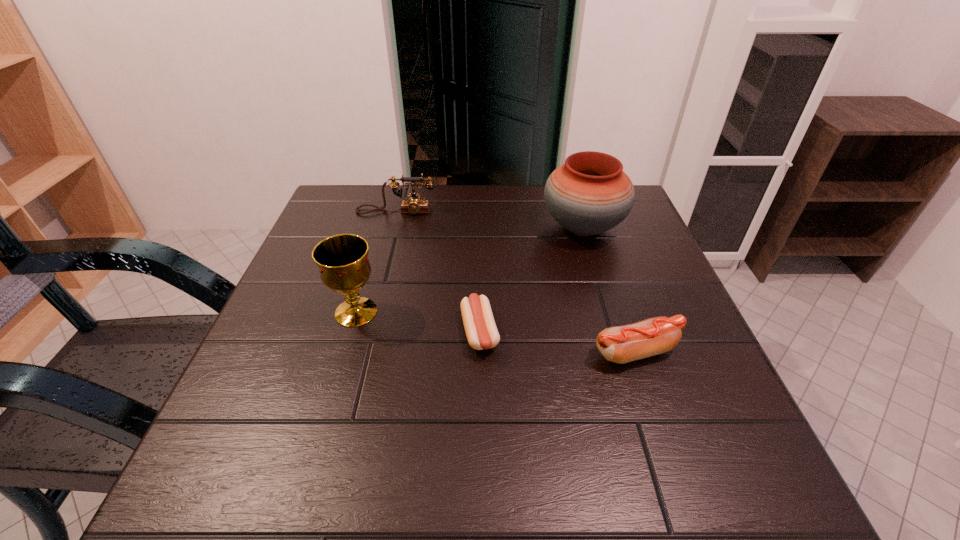
The image size is (960, 540). I want to click on free space between the taller sausage and the telephone, so click(x=516, y=282).

Where is `vacant region between the shortest object and the second shortest object`? This screenshot has height=540, width=960. vacant region between the shortest object and the second shortest object is located at coordinates (558, 342).

In order to click on free space that is in between the taller sausage and the shortest object in this screenshot , I will do `click(558, 342)`.

Locate an element on the screen. This screenshot has height=540, width=960. blank region between the chalice and the third tallest object is located at coordinates (376, 262).

You are a GUI agent. You are given a task and a screenshot of the screen. Output one action in this format:
    pyautogui.click(x=<x>, y=<y>)
    Task: Click on the unoccupied position between the pottery and the chalice
    The width and height of the screenshot is (960, 540).
    Given the screenshot: What is the action you would take?
    pyautogui.click(x=469, y=269)

Where is `the fourth closest object to the pottery`? This screenshot has height=540, width=960. the fourth closest object to the pottery is located at coordinates (343, 261).

Point out which object is positioned as the second nearest to the chalice. Please provide its 2D coordinates. Your answer should be formatted as a tuple, i.e. [(x, y)], where the tuple contains the x and y coordinates of a point satisfying the conditions above.

[(414, 205)]

At what (x,y) coordinates should I click in order to perform the action: click on vacant area in the image that satisfies the following two spatial constraints: 1. on the front-facing side of the pottery; 2. on the right side of the telephone. Please return your answer as a coordinate pair (x, y). The width and height of the screenshot is (960, 540). Looking at the image, I should click on (393, 227).

You are a GUI agent. You are given a task and a screenshot of the screen. Output one action in this format:
    pyautogui.click(x=<x>, y=<y>)
    Task: Click on the free space that satisfies the following two spatial constraints: 1. on the front-facing side of the third object from right to left; 2. on the left side of the telephone
    The image size is (960, 540).
    Given the screenshot: What is the action you would take?
    pyautogui.click(x=365, y=333)

Find the location of a particular element. Image resolution: width=960 pixels, height=540 pixels. free space that satisfies the following two spatial constraints: 1. on the front-facing side of the shorter sausage; 2. on the left side of the telephone is located at coordinates (x=365, y=333).